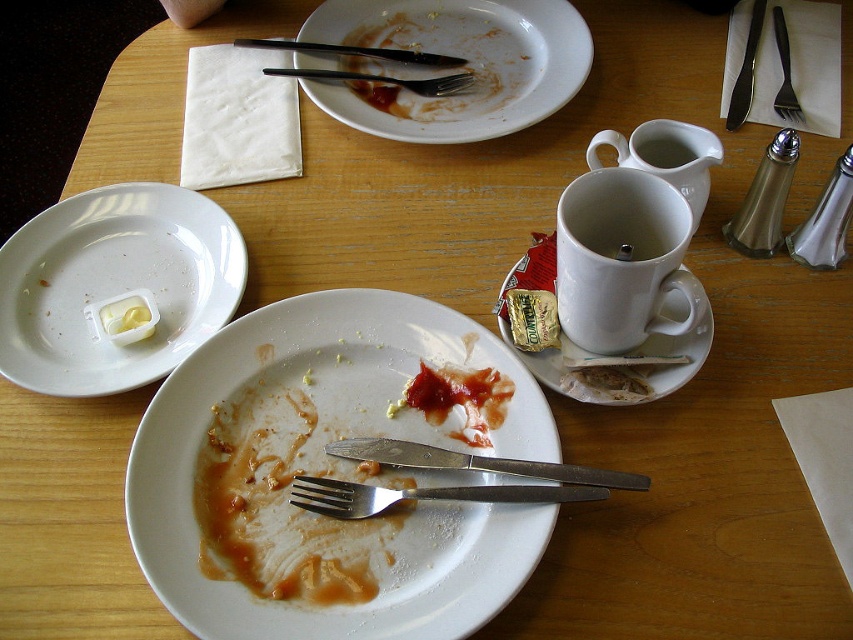
You are standing at the edge of the table looking towards the center. There are two points marked on the table surface labeled as point (x=35, y=300) and point (x=712, y=140). Which point is closer to you?

Point (x=712, y=140) is closer to you because it is in front of point (x=35, y=300).

You are a waiter clearing the table. You need to pick up the black plastic fork at upper center first. Can you lift it without moving the white matte plate at center?

The white matte plate at center is positioned under the black plastic fork at upper center, so you can lift the black plastic fork at upper center without moving the white matte plate at center because the fork is resting on top of the plate.

You are setting up a display for a kitchenware store and need to arrange items based on their size. You have a white matte plate at center and a black plastic fork at upper center. Which item should you place on the bottom shelf if you want the taller item to be visible above the shorter one?

The white matte plate at center is taller than the black plastic fork at upper center, so you should place the black plastic fork at upper center on the bottom shelf so the taller plate can be visible above it.